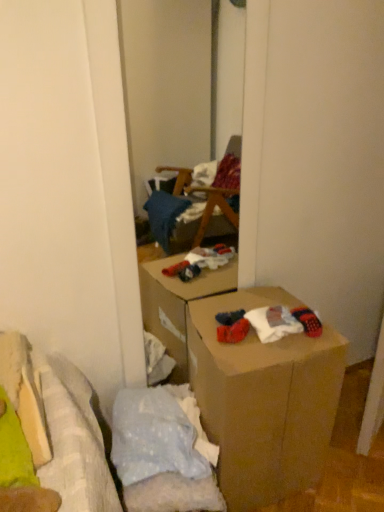
Identify the location of vacant space to the left of knitted wool socks at lower right. The height and width of the screenshot is (512, 384). (249, 337).